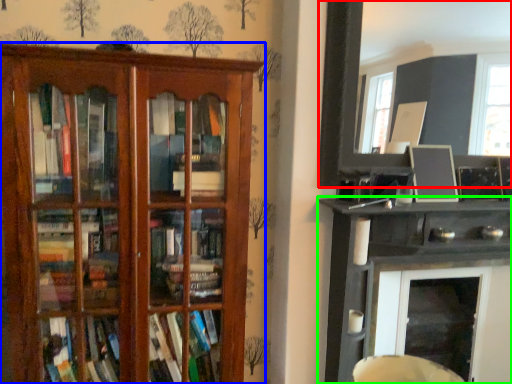
Question: Considering the real-world distances, which object is farthest from picture frame (highlighted by a red box)? shelf (highlighted by a blue box) or shelf (highlighted by a green box)?

Choices:
 (A) shelf
 (B) shelf

Answer: (A)